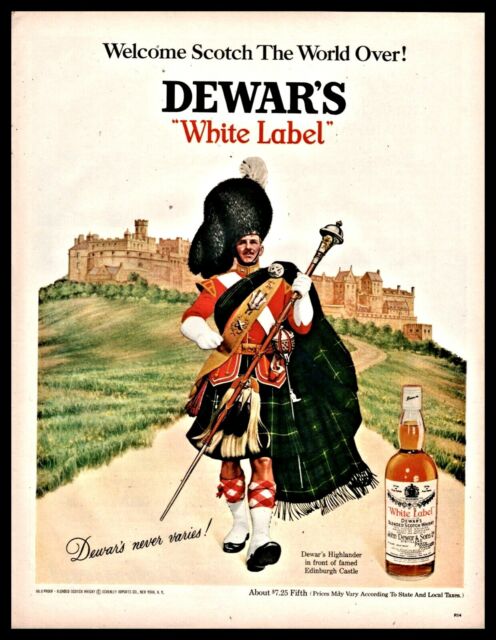
Where is `frame around ad`? The height and width of the screenshot is (640, 496). frame around ad is located at coordinates (291, 635).